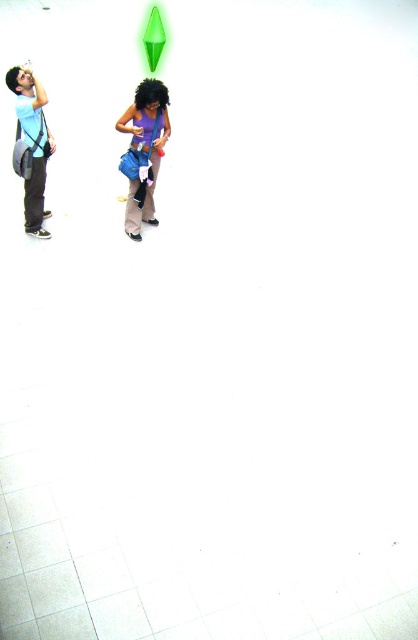
Question: Does matte purple shirt at center have a smaller size compared to matte blue shirt at left?

Choices:
 (A) no
 (B) yes

Answer: (A)

Question: Which of the following is the farthest from the observer?

Choices:
 (A) matte purple shirt at center
 (B) matte blue shirt at left

Answer: (A)

Question: Which point is closer to the camera taking this photo?

Choices:
 (A) (158, 140)
 (B) (28, 212)

Answer: (A)

Question: Is matte purple shirt at center to the left of matte blue shirt at left from the viewer's perspective?

Choices:
 (A) yes
 (B) no

Answer: (B)

Question: Is matte purple shirt at center thinner than matte blue shirt at left?

Choices:
 (A) yes
 (B) no

Answer: (B)